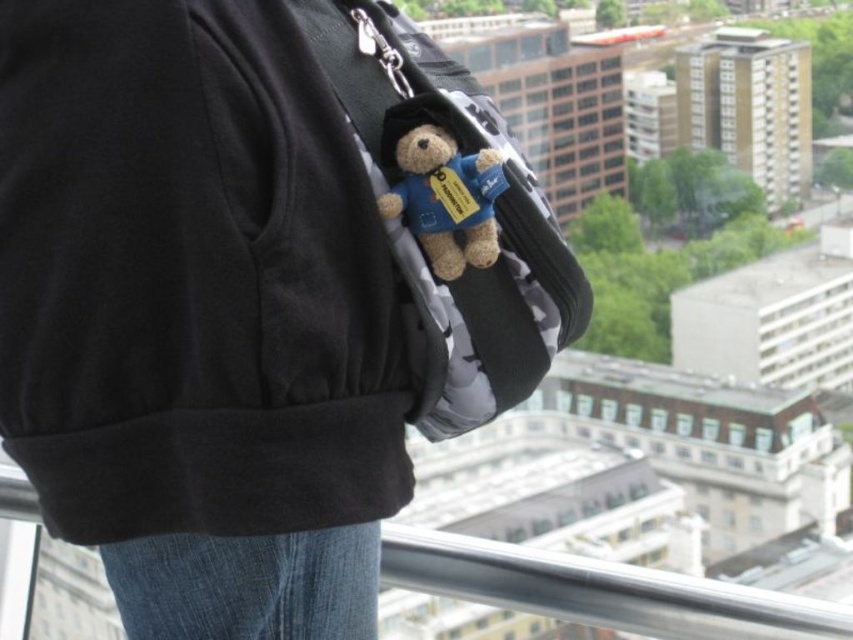
You are a drone operator tasked with delivering a package to a person standing near a camouflage fabric backpack at center. The drone has a maximum operational range of 60 meters. Can the drone safely deliver the package without exceeding its operational limit?

The distance between the camouflage fabric backpack at center and the camera is 61.59 meters, which exceeds the drone operator maximum operational range of 60 meters. Therefore, the drone cannot safely deliver the package without exceeding its operational limit.

You are a delivery drone operator. Your drone needs to fly from the camouflage fabric backpack at center to the fuzzy fabric teddy bear at center. Which direction should the drone fly to reach the teddy bear?

The camouflage fabric backpack at center is below the fuzzy fabric teddy bear at center, so the drone should fly upward to reach the teddy bear.

You are a delivery drone operator. Your drone needs to fly between the camouflage fabric backpack at center and the fuzzy fabric teddy bear at center. Based on their sizes, which object should the drone avoid hitting to ensure safe passage?

The camouflage fabric backpack at center is much taller than the fuzzy fabric teddy bear at center, so the drone should avoid hitting the camouflage fabric backpack at center to ensure safe passage.